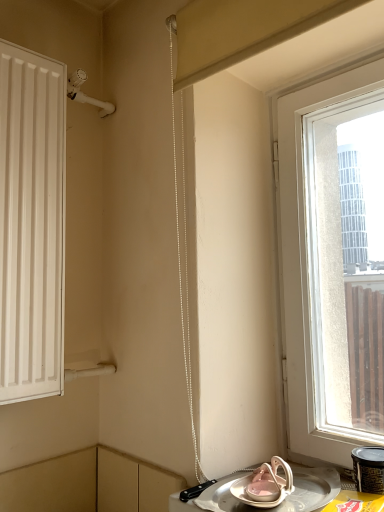
Question: Do you think black plastic container at lower right is within metallic silver tray at lower right, or outside of it?

Choices:
 (A) outside
 (B) inside

Answer: (A)

Question: Looking at the image, does black plastic container at lower right seem bigger or smaller compared to metallic silver tray at lower right?

Choices:
 (A) small
 (B) big

Answer: (A)

Question: Estimate the real-world distances between objects in this image. Which object is farther from the metallic silver tray at lower right?

Choices:
 (A) transparent glass window at right
 (B) black plastic container at lower right

Answer: (A)

Question: Based on their relative distances, which object is farther from the black plastic container at lower right?

Choices:
 (A) transparent glass window at right
 (B) metallic silver tray at lower right

Answer: (A)